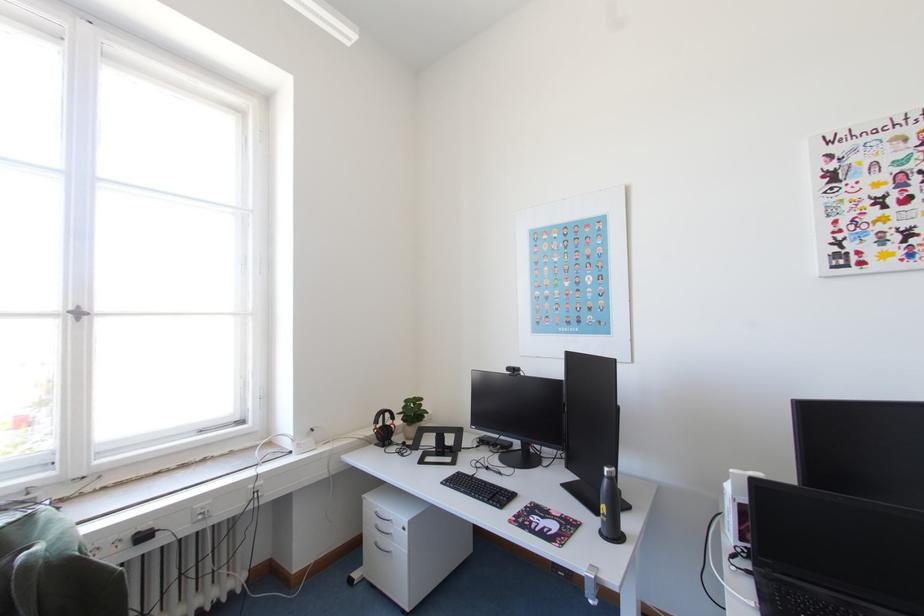
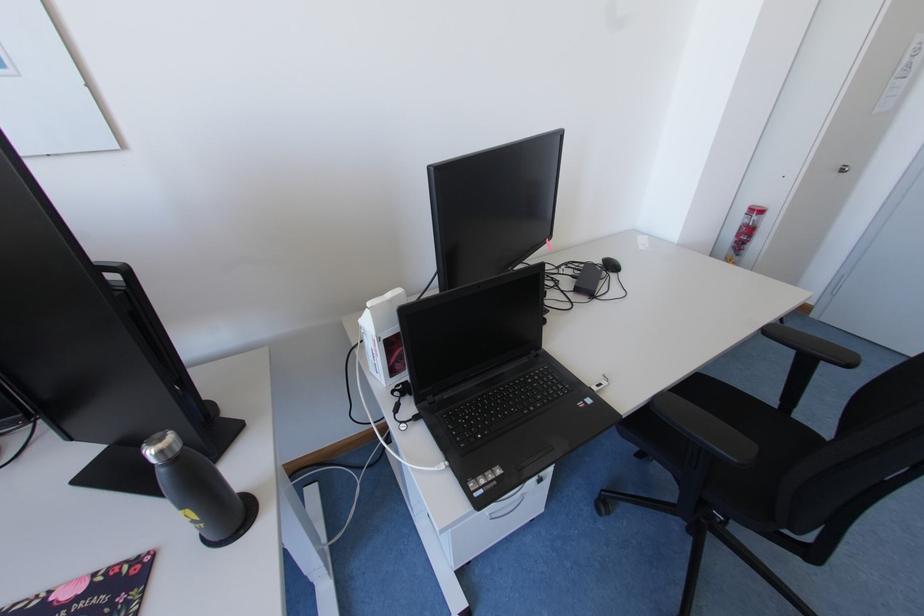
How did the camera likely rotate?

The camera rotated toward right-down.